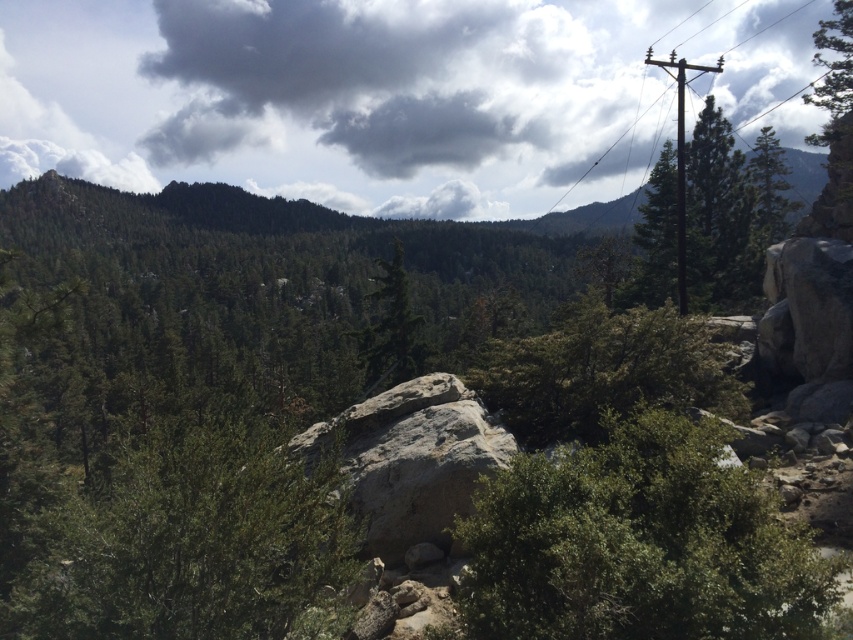
Does dark gray cloud at upper center have a lesser height compared to green matte tree at center?

No.

Looking at this image, is dark gray cloud at upper center positioned in front of green matte tree at center?

No, it is not.

Does point (347, 184) come behind point (393, 269)?

That is True.

This screenshot has width=853, height=640. What are the coordinates of `dark gray cloud at upper center` in the screenshot? It's located at (381, 93).

Who is positioned more to the right, green matte tree at center or brown wooden pole at right?

From the viewer's perspective, brown wooden pole at right appears more on the right side.

Can you confirm if green matte tree at center is smaller than brown wooden pole at right?

Indeed, green matte tree at center has a smaller size compared to brown wooden pole at right.

Identify the location of green matte tree at center. The width and height of the screenshot is (853, 640). (387, 321).

Locate an element on the screen. green matte tree at center is located at coordinates (387, 321).

Who is taller, green leafy shrub at center or brown wooden pole at upper right?

Standing taller between the two is brown wooden pole at upper right.

Which is in front, point (544, 333) or point (637, 109)?

Point (544, 333) is in front.

Is point (527, 444) farther from camera compared to point (808, 1)?

No.

Locate an element on the screen. green leafy shrub at center is located at coordinates 602,371.